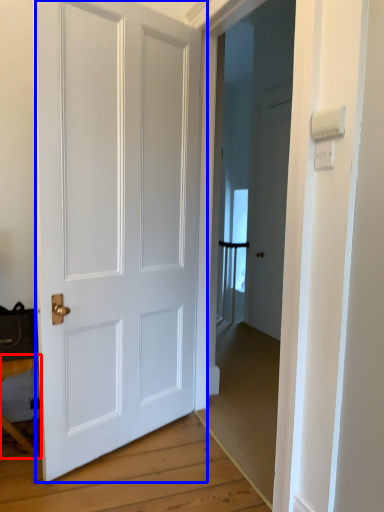
Question: Which point is closer to the camera, table (highlighted by a red box) or door (highlighted by a blue box)?

Choices:
 (A) table
 (B) door

Answer: (B)